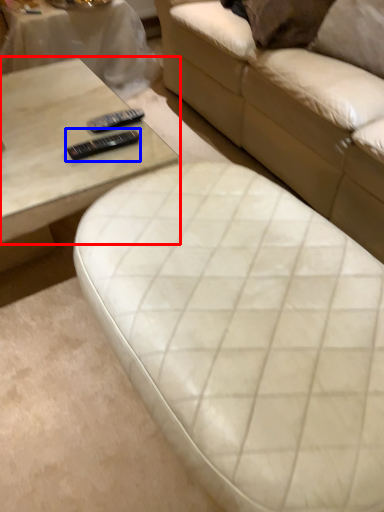
Question: Which point is further to the camera, coffee table (highlighted by a red box) or remote (highlighted by a blue box)?

Choices:
 (A) coffee table
 (B) remote

Answer: (B)